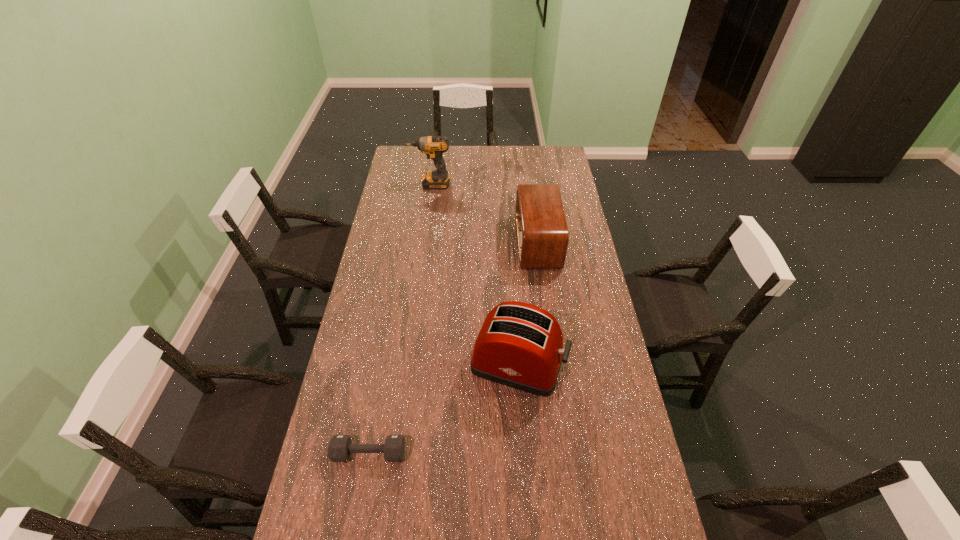
The image size is (960, 540). In order to click on free point located 0.130m on the front panel of the third nearest object in this screenshot , I will do `click(488, 242)`.

You are a GUI agent. You are given a task and a screenshot of the screen. Output one action in this format:
    pyautogui.click(x=<x>, y=<y>)
    Task: Click on the free spot located on the right of the dumbbell
    
    Given the screenshot: What is the action you would take?
    pyautogui.click(x=425, y=453)

I want to click on drill that is at the left edge, so click(x=433, y=146).

Locate an element on the screen. The height and width of the screenshot is (540, 960). dumbbell at the left edge is located at coordinates (339, 449).

Identify the location of object at the right edge. The height and width of the screenshot is (540, 960). (542, 234).

What are the coordinates of `free region at the far edge` in the screenshot? It's located at (490, 153).

Where is `vacant space at the left edge`? The image size is (960, 540). vacant space at the left edge is located at coordinates (348, 482).

Where is `free space at the right edge`? free space at the right edge is located at coordinates (565, 282).

Image resolution: width=960 pixels, height=540 pixels. In the image, there is a desktop. Identify the location of vacant space at the far right corner. (555, 153).

Locate an element on the screen. Image resolution: width=960 pixels, height=540 pixels. free area in between the nearest object and the third shortest object is located at coordinates pos(444,408).